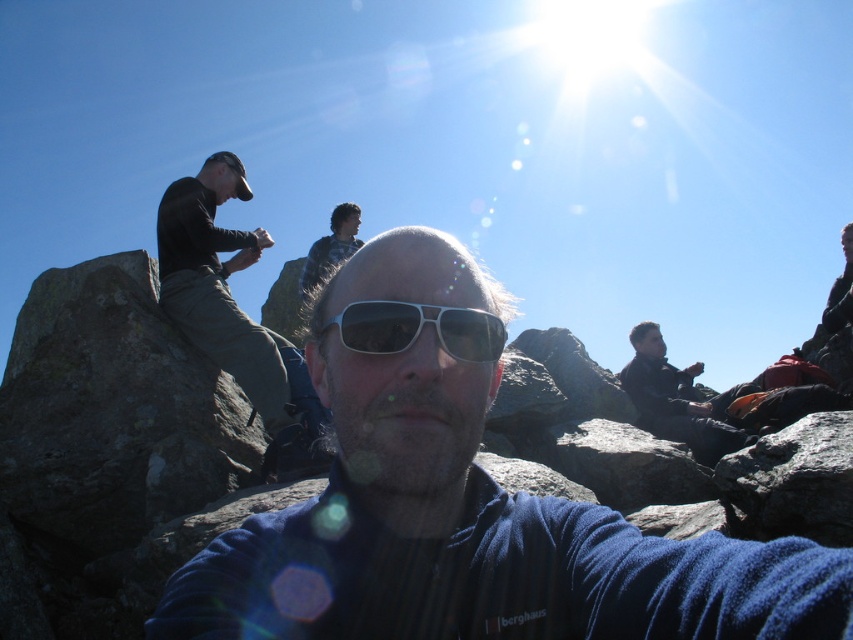
Question: Can you confirm if dark blue jacket at right is thinner than plaid shirt at center?

Choices:
 (A) yes
 (B) no

Answer: (B)

Question: Which object is closer to the camera taking this photo?

Choices:
 (A) dark green fabric pants at left
 (B) plaid shirt at center
 (C) dark blue jacket at right

Answer: (A)

Question: Which of the following is the farthest from the observer?

Choices:
 (A) (395, 288)
 (B) (672, 403)

Answer: (B)

Question: Is blue fabric shirt at center wider than dark green fabric pants at left?

Choices:
 (A) yes
 (B) no

Answer: (B)

Question: Which point is farther from the camera taking this photo?

Choices:
 (A) (407, 328)
 (B) (634, 364)

Answer: (B)

Question: Can you confirm if dark green fabric pants at left is smaller than sunglasses at center?

Choices:
 (A) yes
 (B) no

Answer: (B)